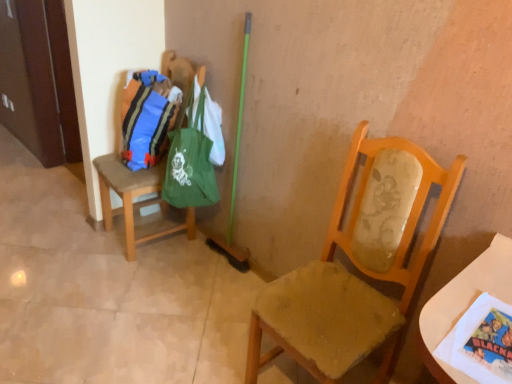
Question: Does matte blue fabric bag at left, placed as the first bag when sorted from left to right, turn towards white paper at lower right?

Choices:
 (A) yes
 (B) no

Answer: (B)

Question: From a real-world perspective, is matte blue fabric bag at left, placed as the first bag when sorted from left to right, on top of white paper at lower right?

Choices:
 (A) no
 (B) yes

Answer: (A)

Question: Is matte blue fabric bag at left, placed as the first bag when sorted from left to right, wider than white paper at lower right?

Choices:
 (A) yes
 (B) no

Answer: (B)

Question: Can you confirm if matte blue fabric bag at left, the 2th bag in the right-to-left sequence, is smaller than white paper at lower right?

Choices:
 (A) yes
 (B) no

Answer: (B)

Question: Considering the relative positions of matte blue fabric bag at left, the 2th bag in the right-to-left sequence, and white paper at lower right in the image provided, is matte blue fabric bag at left, the 2th bag in the right-to-left sequence, to the right of white paper at lower right from the viewer's perspective?

Choices:
 (A) no
 (B) yes

Answer: (A)

Question: Does matte blue fabric bag at left, placed as the first bag when sorted from left to right, come in front of white paper at lower right?

Choices:
 (A) yes
 (B) no

Answer: (B)

Question: Is brown fabric chair at left, marked as the second chair in a front-to-back arrangement, thinner than wooden chair at center, which is the 2th chair in back-to-front order?

Choices:
 (A) yes
 (B) no

Answer: (B)

Question: Can you confirm if brown fabric chair at left, acting as the 1th chair starting from the back, is positioned to the right of wooden chair at center, the first chair in the front-to-back sequence?

Choices:
 (A) yes
 (B) no

Answer: (B)

Question: Does brown fabric chair at left, which appears as the second chair when viewed from the right, lie in front of wooden chair at center, the first chair in the front-to-back sequence?

Choices:
 (A) no
 (B) yes

Answer: (A)

Question: Does brown fabric chair at left, which appears as the second chair when viewed from the right, have a greater width compared to wooden chair at center, which is counted as the first chair, starting from the right?

Choices:
 (A) yes
 (B) no

Answer: (A)

Question: Is brown fabric chair at left, marked as the second chair in a front-to-back arrangement, further to camera compared to wooden chair at center, which is counted as the first chair, starting from the right?

Choices:
 (A) no
 (B) yes

Answer: (B)

Question: Are brown fabric chair at left, acting as the 1th chair starting from the back, and wooden chair at center, which is counted as the first chair, starting from the right, located far from each other?

Choices:
 (A) no
 (B) yes

Answer: (B)

Question: Is white paper at lower right oriented away from green fabric bag at upper left, marked as the second bag in a left-to-right arrangement?

Choices:
 (A) no
 (B) yes

Answer: (A)